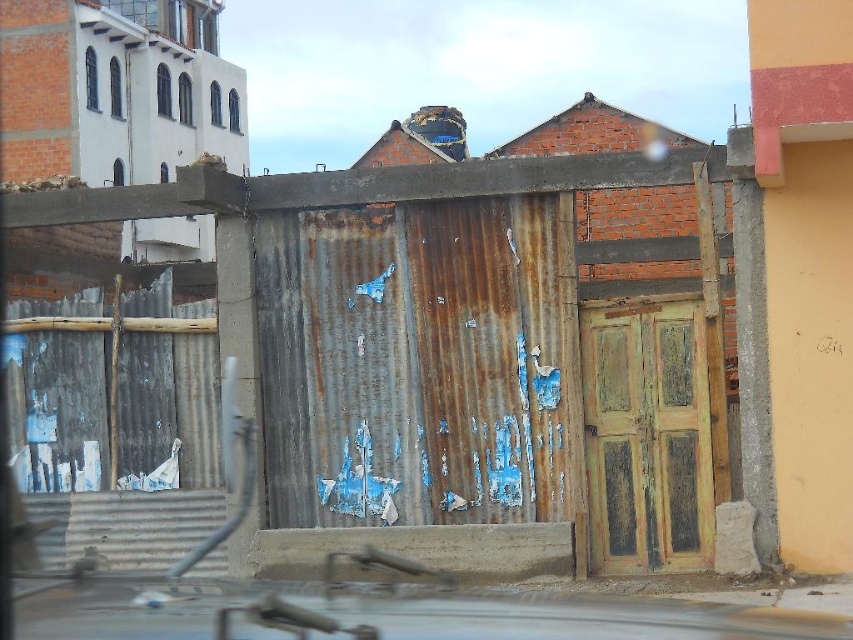
Is metallic car at lower center thinner than rusty wooden door at center?

A: Incorrect, metallic car at lower center's width is not less than rusty wooden door at center's.

Which is more to the left, metallic car at lower center or rusty wooden door at center?

From the viewer's perspective, metallic car at lower center appears more on the left side.

Is point (193, 608) behind point (705, 513)?

No.

Locate an element on the screen. The image size is (853, 640). metallic car at lower center is located at coordinates (378, 612).